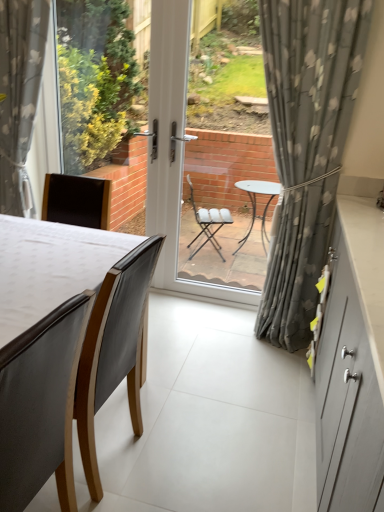
At what (x,y) coordinates should I click in order to perform the action: click on empty space that is in between matte black chair at left, which ranks as the first chair in back-to-front order, and transparent glass door at center. Please return your answer as a coordinate pair (x, y). Image resolution: width=384 pixels, height=512 pixels. Looking at the image, I should click on (186, 358).